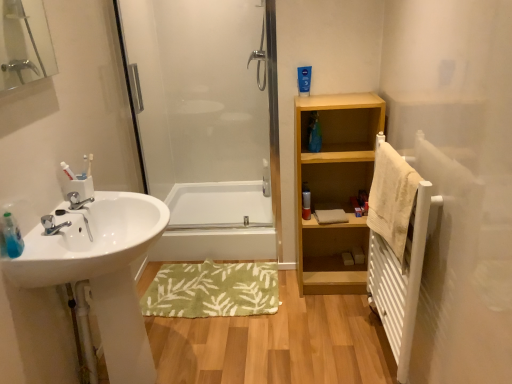
Where is `free spot in front of silver metallic faucet at sink left`? free spot in front of silver metallic faucet at sink left is located at coordinates (60, 222).